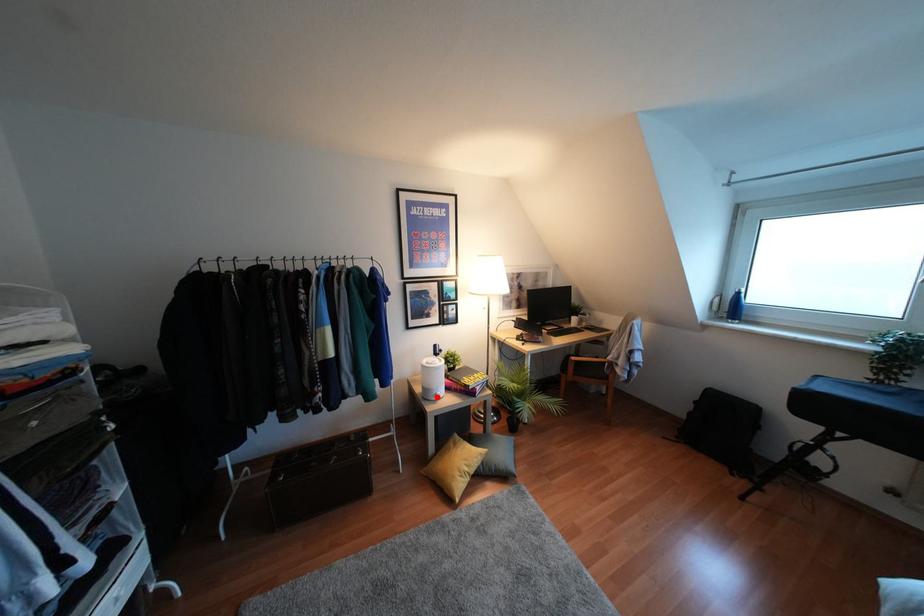
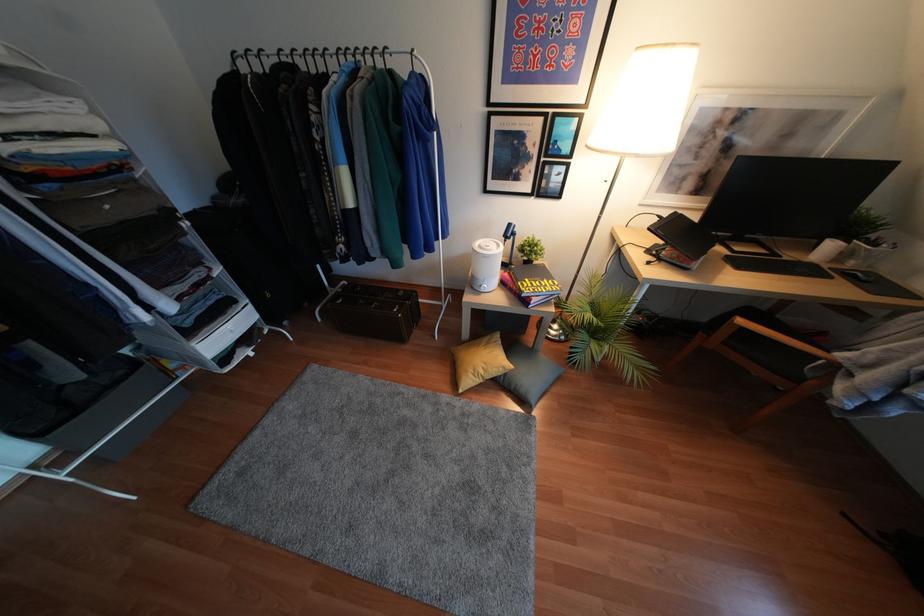
Locate, in the second image, the point that corresponds to the highlighted location in the first image.

(481, 290)